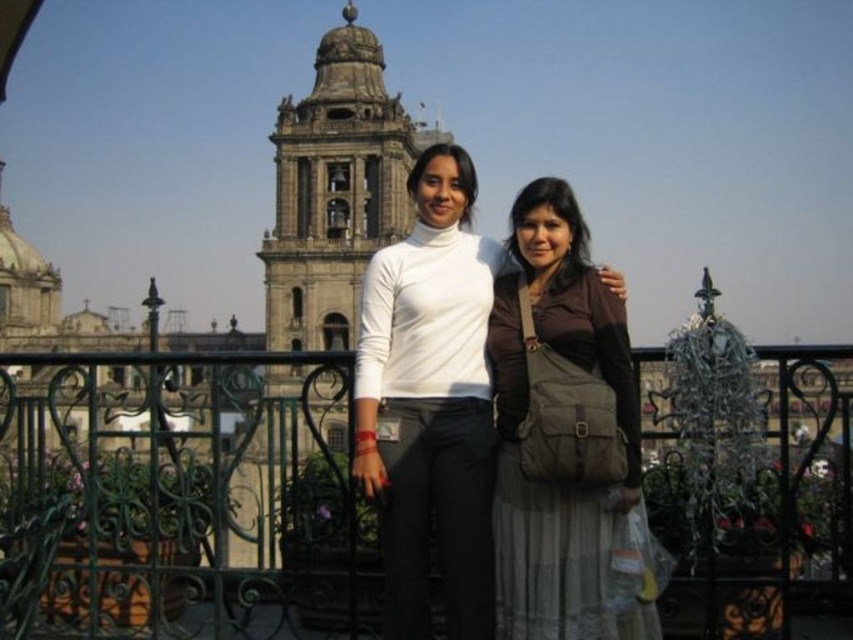
Does green wrought iron railing at center have a larger size compared to matte brown dress at center?

Indeed, green wrought iron railing at center has a larger size compared to matte brown dress at center.

You are a GUI agent. You are given a task and a screenshot of the screen. Output one action in this format:
    pyautogui.click(x=<x>, y=<y>)
    Task: Click on the green wrought iron railing at center
    
    Given the screenshot: What is the action you would take?
    pyautogui.click(x=180, y=499)

The width and height of the screenshot is (853, 640). What are the coordinates of `green wrought iron railing at center` in the screenshot? It's located at (180, 499).

Measure the distance from matte brown bag at center to matte brown dress at center.

They are 23.79 feet apart.

Can you confirm if matte brown bag at center is positioned above matte brown dress at center?

Actually, matte brown bag at center is below matte brown dress at center.

Who is more forward, (523, 349) or (358, 323)?

Point (523, 349) is in front.

Identify the location of matte brown bag at center. Image resolution: width=853 pixels, height=640 pixels. (566, 440).

Does green wrought iron railing at center have a lesser height compared to matte brown bag at center?

Yes.

What do you see at coordinates (180, 499) in the screenshot? This screenshot has height=640, width=853. I see `green wrought iron railing at center` at bounding box center [180, 499].

Where is `green wrought iron railing at center`? The image size is (853, 640). green wrought iron railing at center is located at coordinates (180, 499).